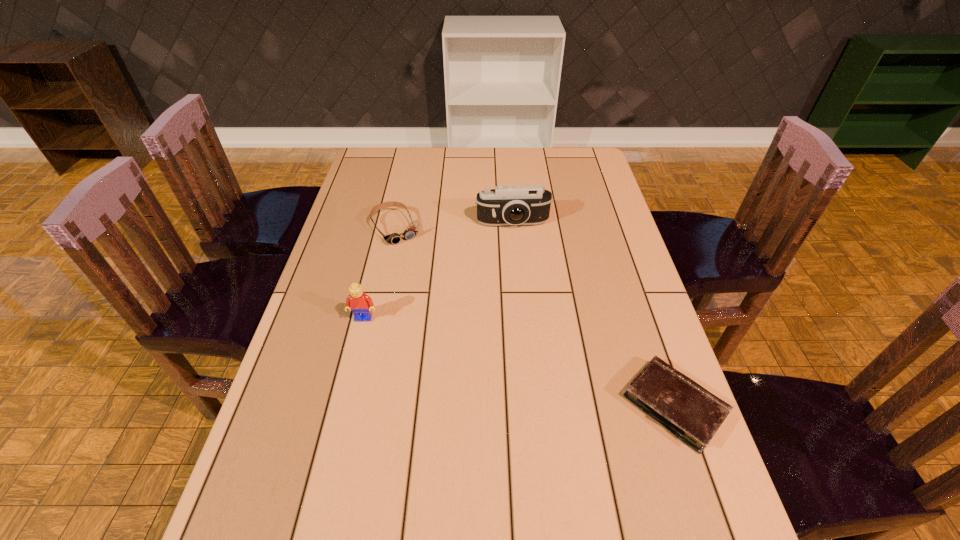
At what (x,y) coordinates should I click in order to perform the action: click on free space on the desktop that is between the third shortest object and the diary and is positioned on the front lens of the camera. Please return your answer as a coordinate pair (x, y). Image resolution: width=960 pixels, height=540 pixels. Looking at the image, I should click on (536, 366).

Find the location of a particular element. This screenshot has width=960, height=540. vacant spot on the desktop that is between the Lego and the diary and is positioned on the front-facing side of the second shortest object is located at coordinates (476, 349).